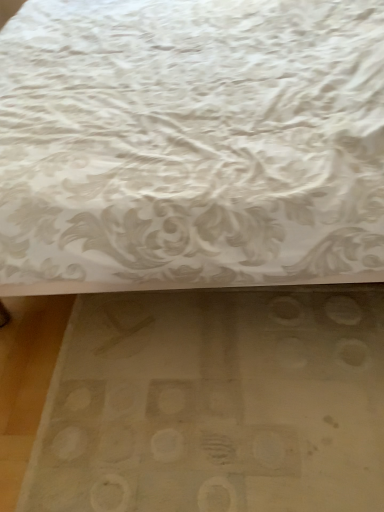
Identify the location of white textured fabric at upper center. 190,144.

What do you see at coordinates (190, 144) in the screenshot?
I see `white textured fabric at upper center` at bounding box center [190, 144].

This screenshot has width=384, height=512. I want to click on white matte mat at lower center, so click(x=215, y=404).

Describe the element at coordinates (215, 404) in the screenshot. The width and height of the screenshot is (384, 512). I see `white matte mat at lower center` at that location.

Locate an element on the screen. Image resolution: width=384 pixels, height=512 pixels. white textured fabric at upper center is located at coordinates (190, 144).

Is white matte mat at lower center at the right side of white textured fabric at upper center?

Yes.

Is white matte mat at lower center positioned before white textured fabric at upper center?

No, it is not.

Considering the points (245, 301) and (104, 249), which point is behind, point (245, 301) or point (104, 249)?

Point (245, 301)

From the image's perspective, who appears lower, white matte mat at lower center or white textured fabric at upper center?

white matte mat at lower center appears lower in the image.

From a real-world perspective, who is located lower, white matte mat at lower center or white textured fabric at upper center?

white matte mat at lower center is physically lower.

Is white matte mat at lower center wider than white textured fabric at upper center?

No.

Considering the relative sizes of white matte mat at lower center and white textured fabric at upper center in the image provided, is white matte mat at lower center shorter than white textured fabric at upper center?

Indeed, white matte mat at lower center has a lesser height compared to white textured fabric at upper center.

In terms of size, does white matte mat at lower center appear bigger or smaller than white textured fabric at upper center?

white matte mat at lower center is smaller than white textured fabric at upper center.

Is white matte mat at lower center not within white textured fabric at upper center?

No, white matte mat at lower center is not outside of white textured fabric at upper center.

Does white matte mat at lower center touch white textured fabric at upper center?

No, white matte mat at lower center is not touching white textured fabric at upper center.

Does white matte mat at lower center turn towards white textured fabric at upper center?

No, white matte mat at lower center is not aimed at white textured fabric at upper center.

Image resolution: width=384 pixels, height=512 pixels. What are the coordinates of `mat on the right of white textured fabric at upper center` in the screenshot? It's located at (215, 404).

Which object is positioned more to the right, white textured fabric at upper center or white matte mat at lower center?

Positioned to the right is white matte mat at lower center.

Considering the relative positions of white textured fabric at upper center and white matte mat at lower center in the image provided, is white textured fabric at upper center in front of white matte mat at lower center?

Yes, white textured fabric at upper center is closer to the viewer.

Does point (108, 249) appear closer or farther from the camera than point (310, 416)?

Point (108, 249) is positioned closer to the camera compared to point (310, 416).

From the image's perspective, which is below, white textured fabric at upper center or white matte mat at lower center?

From the image's view, white matte mat at lower center is below.

From a real-world perspective, between white textured fabric at upper center and white matte mat at lower center, who is vertically higher?

From a 3D spatial view, white textured fabric at upper center is above.

Is white textured fabric at upper center wider than white matte mat at lower center?

Yes, white textured fabric at upper center is wider than white matte mat at lower center.

Considering the sizes of white textured fabric at upper center and white matte mat at lower center in the image, is white textured fabric at upper center taller or shorter than white matte mat at lower center?

In the image, white textured fabric at upper center appears to be taller than white matte mat at lower center.

Considering the sizes of objects white textured fabric at upper center and white matte mat at lower center in the image provided, who is smaller, white textured fabric at upper center or white matte mat at lower center?

white matte mat at lower center is smaller.

Is white matte mat at lower center inside white textured fabric at upper center?

That's correct, white matte mat at lower center is inside white textured fabric at upper center.

Is white textured fabric at upper center far from white matte mat at lower center?

No, white textured fabric at upper center is in close proximity to white matte mat at lower center.

Looking at this image, is white textured fabric at upper center facing towards white matte mat at lower center?

No, white textured fabric at upper center is not facing towards white matte mat at lower center.

How many degrees apart are the facing directions of white textured fabric at upper center and white matte mat at lower center?

white textured fabric at upper center and white matte mat at lower center are facing 89 degrees away from each other.

There is a white matte mat at lower center. At what (x,y) coordinates should I click in order to perform the action: click on bed above it (from a real-world perspective). Please return your answer as a coordinate pair (x, y). Looking at the image, I should click on (190, 144).

Where is `mat behind the white textured fabric at upper center`? This screenshot has width=384, height=512. mat behind the white textured fabric at upper center is located at coordinates (215, 404).

You are a GUI agent. You are given a task and a screenshot of the screen. Output one action in this format:
    pyautogui.click(x=<x>, y=<y>)
    Task: Click on the bed above the white matte mat at lower center (from a real-world perspective)
    Image resolution: width=384 pixels, height=512 pixels.
    Given the screenshot: What is the action you would take?
    pyautogui.click(x=190, y=144)